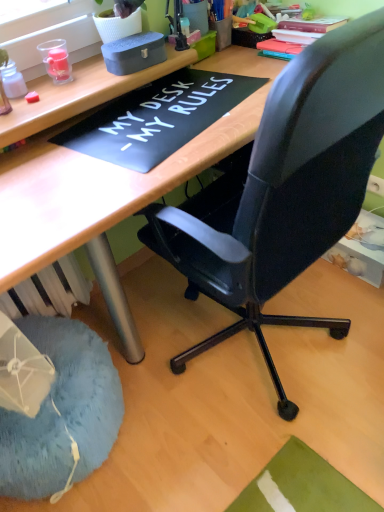
This screenshot has width=384, height=512. What are the coordinates of `blue fuzzy bean bag at lower left` in the screenshot? It's located at (62, 412).

At what (x,y) coordinates should I click in order to perform the action: click on translucent plastic bottle at upper left, which is the second stationery from right to left. Please return your answer as a coordinate pair (x, y). Looking at the image, I should click on (12, 81).

Find the location of `wooden desk at center`. wooden desk at center is located at coordinates (98, 204).

Considering the sizes of objects blue fuzzy bean bag at lower left and matte gray box at upper center, the 2th stationery from the left, in the image provided, who is thinner, blue fuzzy bean bag at lower left or matte gray box at upper center, the 2th stationery from the left,?

matte gray box at upper center, the 2th stationery from the left.

Would you consider blue fuzzy bean bag at lower left to be distant from matte gray box at upper center, the 2th stationery from the left?

No.

Is blue fuzzy bean bag at lower left turned away from matte gray box at upper center, positioned as the first stationery in right-to-left order?

No, blue fuzzy bean bag at lower left is not facing the opposite direction of matte gray box at upper center, positioned as the first stationery in right-to-left order.

Consider the image. Could you measure the distance between blue fuzzy bean bag at lower left and matte gray box at upper center, the 2th stationery from the left?

blue fuzzy bean bag at lower left and matte gray box at upper center, the 2th stationery from the left, are 38.78 inches apart from each other.

Is translucent plastic bottle at upper left, which is the 1th stationery in left-to-right order, at the left side of blue fuzzy bean bag at lower left?

Yes, translucent plastic bottle at upper left, which is the 1th stationery in left-to-right order, is to the left of blue fuzzy bean bag at lower left.

Is translucent plastic bottle at upper left, which is the second stationery from right to left, positioned with its back to blue fuzzy bean bag at lower left?

No.

From the image's perspective, is translucent plastic bottle at upper left, which is the second stationery from right to left, above or below blue fuzzy bean bag at lower left?

Clearly, from the image's perspective, translucent plastic bottle at upper left, which is the second stationery from right to left, is above blue fuzzy bean bag at lower left.

Measure the distance from translucent plastic bottle at upper left, which is the 1th stationery in left-to-right order, to blue fuzzy bean bag at lower left.

translucent plastic bottle at upper left, which is the 1th stationery in left-to-right order, and blue fuzzy bean bag at lower left are 35.47 inches apart from each other.

Which is nearer, (107, 46) or (26, 93)?

Point (107, 46) appears to be farther away from the viewer than point (26, 93).

Which object is closer to the camera taking this photo, matte gray box at upper center, the 2th stationery from the left, or translucent plastic bottle at upper left, which is the 1th stationery in left-to-right order?

Positioned in front is translucent plastic bottle at upper left, which is the 1th stationery in left-to-right order.

Can you confirm if matte gray box at upper center, positioned as the first stationery in right-to-left order, is smaller than translucent plastic bottle at upper left, which is the second stationery from right to left?

No, matte gray box at upper center, positioned as the first stationery in right-to-left order, is not smaller than translucent plastic bottle at upper left, which is the second stationery from right to left.

Based on the photo, is matte gray box at upper center, the 2th stationery from the left, shorter than translucent plastic bottle at upper left, which is the 1th stationery in left-to-right order?

No, matte gray box at upper center, the 2th stationery from the left, is not shorter than translucent plastic bottle at upper left, which is the 1th stationery in left-to-right order.

Is point (55, 377) farther from viewer compared to point (220, 122)?

Yes, point (55, 377) is farther from viewer.

Is blue fuzzy bean bag at lower left taller than wooden desk at center?

No, blue fuzzy bean bag at lower left is not taller than wooden desk at center.

Locate an element on the screen. The height and width of the screenshot is (512, 384). computer desk located on the right of blue fuzzy bean bag at lower left is located at coordinates (98, 204).

From the image's perspective, which is above, blue fuzzy bean bag at lower left or wooden desk at center?

wooden desk at center.

Is the depth of wooden desk at center greater than that of translucent plastic bottle at upper left, which is the second stationery from right to left?

No, wooden desk at center is closer to the viewer.

Is wooden desk at center located outside translucent plastic bottle at upper left, which is the 1th stationery in left-to-right order?

Indeed, wooden desk at center is completely outside translucent plastic bottle at upper left, which is the 1th stationery in left-to-right order.

Find the location of a particular element. the 1st stationery positioned above the wooden desk at center (from the image's perspective) is located at coordinates (12, 81).

Is wooden desk at center with translucent plastic bottle at upper left, which is the second stationery from right to left?

No, wooden desk at center is not next to translucent plastic bottle at upper left, which is the second stationery from right to left.

Considering the relative positions of wooden desk at center and blue fuzzy bean bag at lower left in the image provided, is wooden desk at center to the left of blue fuzzy bean bag at lower left from the viewer's perspective?

Incorrect, wooden desk at center is not on the left side of blue fuzzy bean bag at lower left.

Is wooden desk at center positioned in front of blue fuzzy bean bag at lower left?

Yes, wooden desk at center is closer to the camera.

From a real-world perspective, is wooden desk at center on blue fuzzy bean bag at lower left?

Correct, in the physical world, wooden desk at center is higher than blue fuzzy bean bag at lower left.

Is wooden desk at center looking in the opposite direction of blue fuzzy bean bag at lower left?

No, blue fuzzy bean bag at lower left is not at the back of wooden desk at center.

From a real-world perspective, relative to matte gray box at upper center, positioned as the first stationery in right-to-left order, is translucent plastic bottle at upper left, which is the second stationery from right to left, vertically above or below?

translucent plastic bottle at upper left, which is the second stationery from right to left, is below matte gray box at upper center, positioned as the first stationery in right-to-left order.

Is there a large distance between translucent plastic bottle at upper left, which is the 1th stationery in left-to-right order, and matte gray box at upper center, the 2th stationery from the left?

That's not correct — translucent plastic bottle at upper left, which is the 1th stationery in left-to-right order, is a little close to matte gray box at upper center, the 2th stationery from the left.

Is translucent plastic bottle at upper left, which is the 1th stationery in left-to-right order, facing away from matte gray box at upper center, positioned as the first stationery in right-to-left order?

No, matte gray box at upper center, positioned as the first stationery in right-to-left order, is not at the back of translucent plastic bottle at upper left, which is the 1th stationery in left-to-right order.

Would you say translucent plastic bottle at upper left, which is the second stationery from right to left, is inside or outside matte gray box at upper center, positioned as the first stationery in right-to-left order?

translucent plastic bottle at upper left, which is the second stationery from right to left, is outside matte gray box at upper center, positioned as the first stationery in right-to-left order.

Locate an element on the screen. The width and height of the screenshot is (384, 512). bean bag chair that is below the matte gray box at upper center, the 2th stationery from the left (from the image's perspective) is located at coordinates (62, 412).

I want to click on stationery lying on the left of blue fuzzy bean bag at lower left, so click(12, 81).

Which object lies further to the anchor point blue fuzzy bean bag at lower left, wooden desk at center or translucent plastic bottle at upper left, which is the 1th stationery in left-to-right order?

translucent plastic bottle at upper left, which is the 1th stationery in left-to-right order, is positioned further to the anchor blue fuzzy bean bag at lower left.

Looking at the image, which one is located further to translucent plastic bottle at upper left, which is the second stationery from right to left, matte gray box at upper center, positioned as the first stationery in right-to-left order, or wooden desk at center?

Among the two, wooden desk at center is located further to translucent plastic bottle at upper left, which is the second stationery from right to left.

Which object lies nearer to the anchor point blue fuzzy bean bag at lower left, translucent plastic bottle at upper left, which is the second stationery from right to left, or matte gray box at upper center, the 2th stationery from the left?

translucent plastic bottle at upper left, which is the second stationery from right to left, is closer to blue fuzzy bean bag at lower left.

From the image, which object appears to be farther from wooden desk at center, blue fuzzy bean bag at lower left or translucent plastic bottle at upper left, which is the second stationery from right to left?

translucent plastic bottle at upper left, which is the second stationery from right to left, is positioned further to the anchor wooden desk at center.

Based on their spatial positions, is translucent plastic bottle at upper left, which is the 1th stationery in left-to-right order, or wooden desk at center further from blue fuzzy bean bag at lower left?

translucent plastic bottle at upper left, which is the 1th stationery in left-to-right order, lies further to blue fuzzy bean bag at lower left than the other object.

When comparing their distances from wooden desk at center, does blue fuzzy bean bag at lower left or matte gray box at upper center, positioned as the first stationery in right-to-left order, seem further?

The object further to wooden desk at center is blue fuzzy bean bag at lower left.

Looking at the image, which one is located closer to matte gray box at upper center, positioned as the first stationery in right-to-left order, blue fuzzy bean bag at lower left or wooden desk at center?

wooden desk at center lies closer to matte gray box at upper center, positioned as the first stationery in right-to-left order, than the other object.

When comparing their distances from blue fuzzy bean bag at lower left, does matte gray box at upper center, the 2th stationery from the left, or translucent plastic bottle at upper left, which is the 1th stationery in left-to-right order, seem further?

matte gray box at upper center, the 2th stationery from the left, is positioned further to the anchor blue fuzzy bean bag at lower left.

Where is `computer desk between matte gray box at upper center, the 2th stationery from the left, and blue fuzzy bean bag at lower left in the up-down direction`? This screenshot has width=384, height=512. computer desk between matte gray box at upper center, the 2th stationery from the left, and blue fuzzy bean bag at lower left in the up-down direction is located at coordinates (98, 204).

Where is `stationery between wooden desk at center and matte gray box at upper center, the 2th stationery from the left, from front to back`? stationery between wooden desk at center and matte gray box at upper center, the 2th stationery from the left, from front to back is located at coordinates (12, 81).

Find the location of a particular element. The width and height of the screenshot is (384, 512). stationery between matte gray box at upper center, the 2th stationery from the left, and blue fuzzy bean bag at lower left, in the vertical direction is located at coordinates (12, 81).

Find the location of a particular element. computer desk between translucent plastic bottle at upper left, which is the second stationery from right to left, and blue fuzzy bean bag at lower left, in the vertical direction is located at coordinates (98, 204).